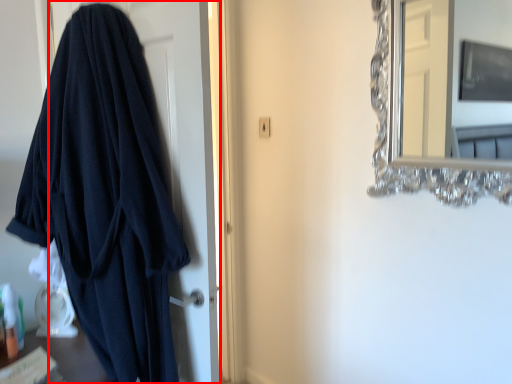
Question: Considering the relative positions of door (annotated by the red box) and mirror in the image provided, where is door (annotated by the red box) located with respect to the staircase?

Choices:
 (A) left
 (B) right

Answer: (A)